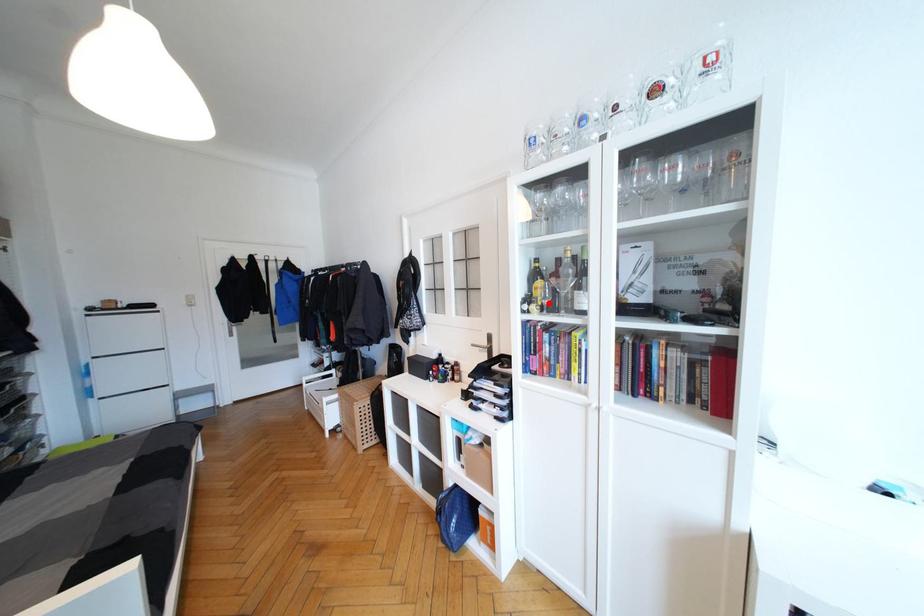
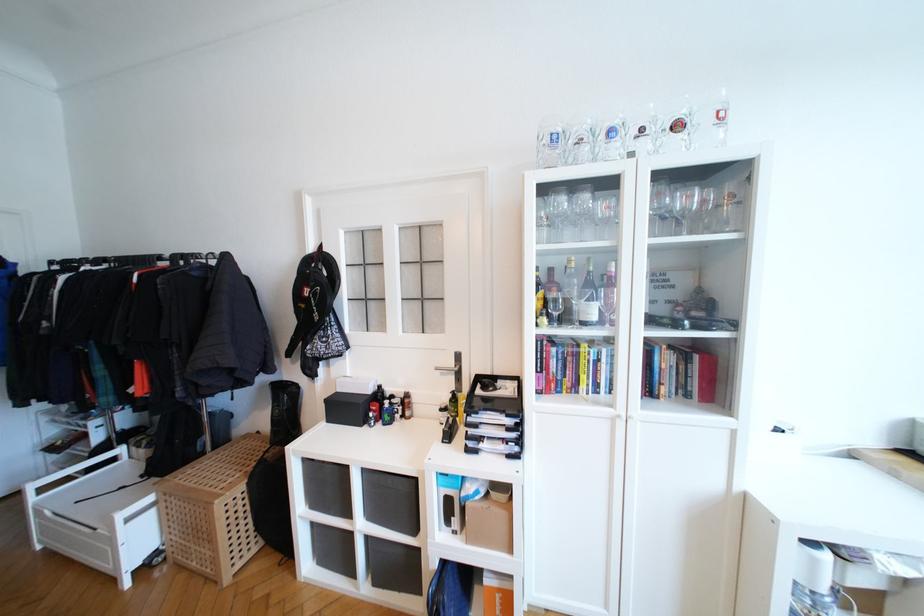
Where in the second image is the point corresponding to the highlighted location from the first image?

(558, 315)